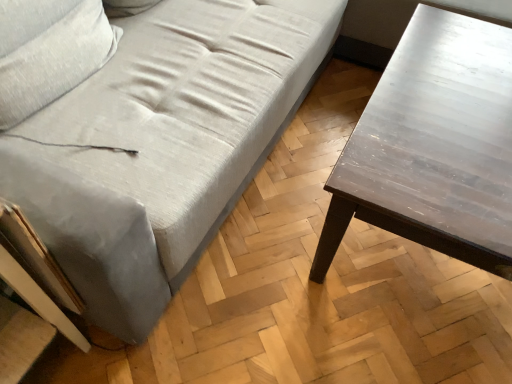
Image resolution: width=512 pixels, height=384 pixels. Find the location of `free space to the left of dark brown wooden table at right`. free space to the left of dark brown wooden table at right is located at coordinates (267, 248).